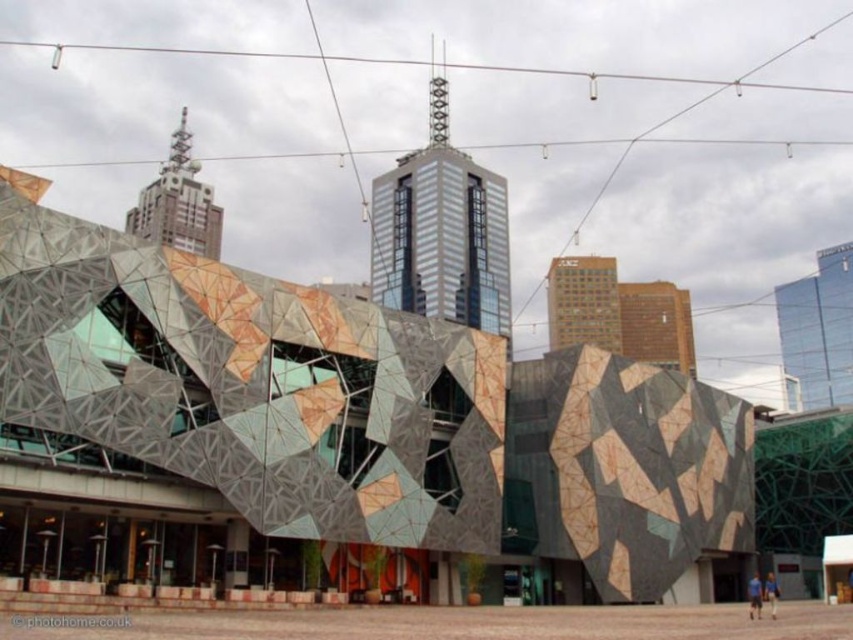
Question: Among these points, which one is farthest from the camera?

Choices:
 (A) (469, 298)
 (B) (198, 164)
 (C) (825, 328)

Answer: (B)

Question: Where is glassy steel skyscraper at center located in relation to metallic glass skyscraper at upper center in the image?

Choices:
 (A) below
 (B) above

Answer: (A)

Question: Based on their relative distances, which object is nearer to the glassy steel skyscraper at center?

Choices:
 (A) metallic glass skyscraper at upper center
 (B) glassy reflective skyscraper at upper right

Answer: (B)

Question: Which point appears farthest from the camera in this image?

Choices:
 (A) (479, 276)
 (B) (838, 362)

Answer: (A)

Question: Does glassy reflective skyscraper at upper right have a greater width compared to metallic glass skyscraper at upper center?

Choices:
 (A) no
 (B) yes

Answer: (A)

Question: Does glassy steel skyscraper at center have a greater width compared to glassy reflective skyscraper at upper right?

Choices:
 (A) no
 (B) yes

Answer: (B)